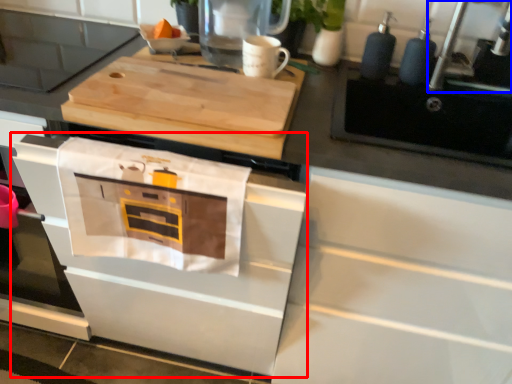
Question: Which object is further to the camera taking this photo, oven (highlighted by a red box) or faucet (highlighted by a blue box)?

Choices:
 (A) oven
 (B) faucet

Answer: (B)